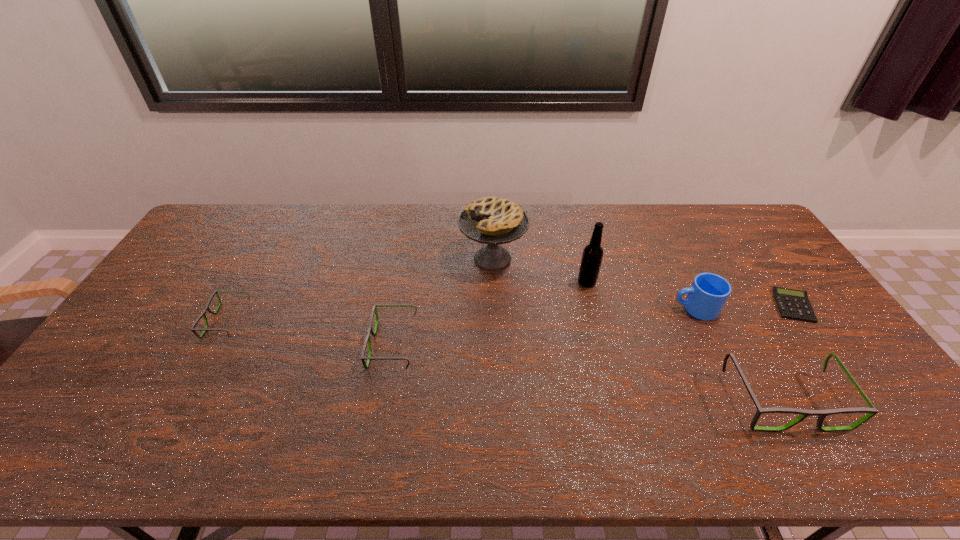
This screenshot has width=960, height=540. I want to click on the sixth tallest object, so click(193, 330).

The image size is (960, 540). I want to click on the shortest spectacles, so click(193, 330).

At what (x,y) coordinates should I click in order to perform the action: click on the third shortest object. Please return your answer as a coordinate pair (x, y). Image resolution: width=960 pixels, height=540 pixels. Looking at the image, I should click on (367, 340).

In order to click on the second shortest spectacles in this screenshot , I will do [367, 340].

You are a GUI agent. You are given a task and a screenshot of the screen. Output one action in this format:
    pyautogui.click(x=<x>, y=<y>)
    Task: Click on the tallest spectacles
    This screenshot has width=960, height=540.
    Given the screenshot: What is the action you would take?
    pyautogui.click(x=871, y=411)

The width and height of the screenshot is (960, 540). What are the coordinates of `beer bottle` in the screenshot? It's located at (592, 255).

The image size is (960, 540). I want to click on the rightmost object, so click(x=793, y=304).

This screenshot has height=540, width=960. In order to click on the shortest object in this screenshot , I will do `click(793, 304)`.

You are a GUI agent. You are given a task and a screenshot of the screen. Output one action in this format:
    pyautogui.click(x=<x>, y=<y>)
    Task: Click on the third object from left to right
    
    Given the screenshot: What is the action you would take?
    pyautogui.click(x=490, y=220)

The height and width of the screenshot is (540, 960). I want to click on mug, so click(x=706, y=297).